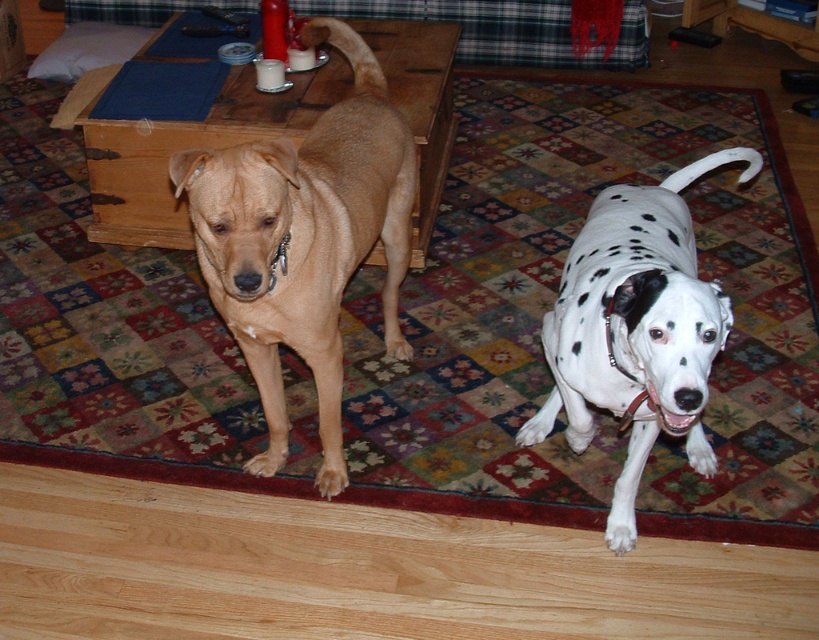
Question: Can you confirm if white-spotted fur at center is positioned below matte tan dog at center?

Choices:
 (A) yes
 (B) no

Answer: (A)

Question: Which object appears farthest from the camera in this image?

Choices:
 (A) matte tan dog at center
 (B) light brown fur at center
 (C) white-spotted fur at center

Answer: (A)

Question: Which point appears closest to the camera in this image?

Choices:
 (A) (299, 289)
 (B) (279, 115)

Answer: (A)

Question: Does light brown fur at center have a lesser width compared to white-spotted fur at center?

Choices:
 (A) yes
 (B) no

Answer: (A)

Question: Which point appears farthest from the camera in this image?

Choices:
 (A) (333, 214)
 (B) (311, 108)
 (C) (584, 227)

Answer: (B)

Question: Does white-spotted fur at center appear over matte tan dog at center?

Choices:
 (A) no
 (B) yes

Answer: (A)